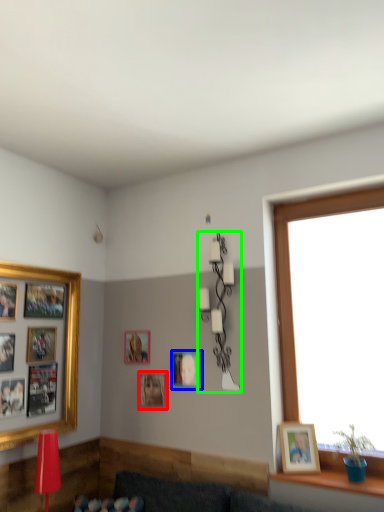
Question: Which object is the closest to the picture frame (highlighted by a red box)? Choose among these: picture frame (highlighted by a blue box) or lamp (highlighted by a green box).

Choices:
 (A) picture frame
 (B) lamp

Answer: (A)